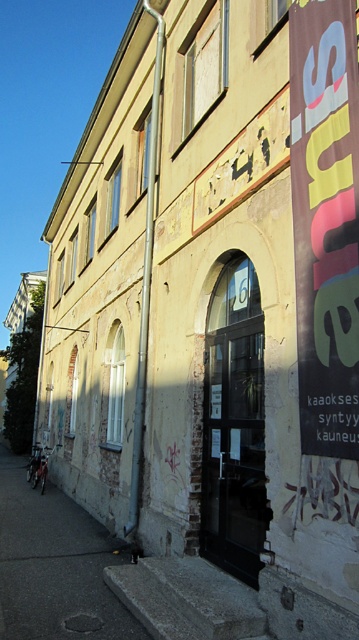
Question: Does yellow fabric banner at right appear over dark concrete alley at lower left?

Choices:
 (A) yes
 (B) no

Answer: (A)

Question: Can you confirm if yellow fabric banner at right is wider than dark concrete alley at lower left?

Choices:
 (A) no
 (B) yes

Answer: (A)

Question: Which of the following is the farthest from the observer?

Choices:
 (A) yellow fabric banner at right
 (B) dark concrete alley at lower left

Answer: (B)

Question: Observing the image, what is the correct spatial positioning of yellow fabric banner at right in reference to dark concrete alley at lower left?

Choices:
 (A) below
 (B) above

Answer: (B)

Question: Among these objects, which one is farthest from the camera?

Choices:
 (A) dark concrete alley at lower left
 (B) yellow fabric banner at right

Answer: (A)